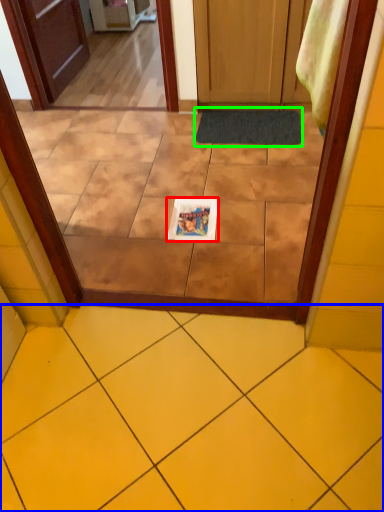
Question: Estimate the real-world distances between objects in this image. Which object is closer to magazine (highlighted by a red box), ceramic tile (highlighted by a blue box) or doormat (highlighted by a green box)?

Choices:
 (A) ceramic tile
 (B) doormat

Answer: (B)